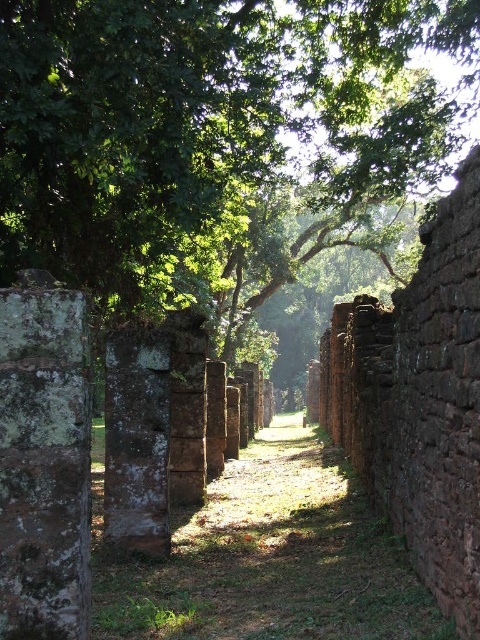
Is green leafy tree at center closer to camera compared to rusty stone pillar at center?

Yes, green leafy tree at center is closer to the viewer.

Can you confirm if green leafy tree at center is shorter than rusty stone pillar at center?

Correct, green leafy tree at center is not as tall as rusty stone pillar at center.

Measure the distance between green leafy tree at center and camera.

green leafy tree at center and camera are 5.56 meters apart.

Find the location of `green leafy tree at center`. green leafy tree at center is located at coordinates (201, 120).